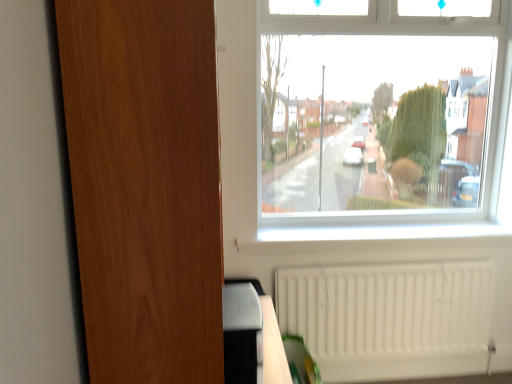
Question: Considering the relative positions of white matte radiator at lower right and wooden screen door at left in the image provided, is white matte radiator at lower right to the left of wooden screen door at left from the viewer's perspective?

Choices:
 (A) yes
 (B) no

Answer: (B)

Question: Is white matte radiator at lower right at the right side of wooden screen door at left?

Choices:
 (A) no
 (B) yes

Answer: (B)

Question: Is white matte radiator at lower right looking in the opposite direction of wooden screen door at left?

Choices:
 (A) no
 (B) yes

Answer: (A)

Question: Is white matte radiator at lower right outside of wooden screen door at left?

Choices:
 (A) no
 (B) yes

Answer: (B)

Question: Does white matte radiator at lower right have a lesser height compared to wooden screen door at left?

Choices:
 (A) yes
 (B) no

Answer: (A)

Question: Are white matte radiator at lower right and wooden screen door at left located far from each other?

Choices:
 (A) no
 (B) yes

Answer: (B)

Question: Considering the relative sizes of wooden screen door at left and white matte radiator at lower right in the image provided, is wooden screen door at left smaller than white matte radiator at lower right?

Choices:
 (A) yes
 (B) no

Answer: (B)

Question: Can you confirm if wooden screen door at left is thinner than white matte radiator at lower right?

Choices:
 (A) no
 (B) yes

Answer: (A)

Question: From the image's perspective, is wooden screen door at left located above white matte radiator at lower right?

Choices:
 (A) yes
 (B) no

Answer: (A)

Question: Is wooden screen door at left oriented away from white matte radiator at lower right?

Choices:
 (A) no
 (B) yes

Answer: (A)

Question: From a real-world perspective, is wooden screen door at left under white matte radiator at lower right?

Choices:
 (A) no
 (B) yes

Answer: (A)

Question: Considering the relative sizes of wooden screen door at left and white matte radiator at lower right in the image provided, is wooden screen door at left shorter than white matte radiator at lower right?

Choices:
 (A) no
 (B) yes

Answer: (A)

Question: Considering the positions of point (477, 365) and point (207, 284), is point (477, 365) closer or farther from the camera than point (207, 284)?

Choices:
 (A) farther
 (B) closer

Answer: (A)